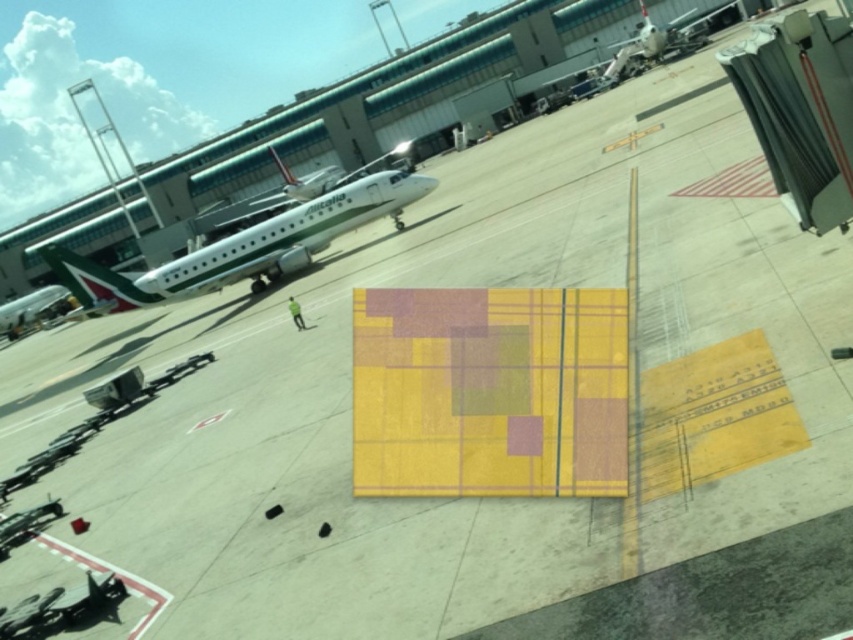
Can you confirm if white glossy airplane at upper center is shorter than metallic silver airplane at left?

Incorrect, white glossy airplane at upper center's height does not fall short of metallic silver airplane at left's.

Does white glossy airplane at upper center lie behind metallic silver airplane at left?

No.

Is point (248, 257) closer to camera compared to point (42, 305)?

Yes, point (248, 257) is closer to viewer.

You are a GUI agent. You are given a task and a screenshot of the screen. Output one action in this format:
    pyautogui.click(x=<x>, y=<y>)
    Task: Click on the white glossy airplane at upper center
    This screenshot has width=853, height=640.
    Given the screenshot: What is the action you would take?
    pyautogui.click(x=241, y=248)

Does point (189, 260) come behind point (685, 52)?

No, it is in front of (685, 52).

Does white glossy airplane at upper center have a lesser width compared to white glossy airplane at upper right?

In fact, white glossy airplane at upper center might be wider than white glossy airplane at upper right.

In order to click on white glossy airplane at upper center in this screenshot , I will do `click(241, 248)`.

At what (x,y) coordinates should I click in order to perform the action: click on white glossy airplane at upper center. Please return your answer as a coordinate pair (x, y). Looking at the image, I should click on (241, 248).

Who is lower down, white glossy airplane at upper right or metallic silver airplane at left?

Positioned lower is metallic silver airplane at left.

Is point (631, 45) behind point (44, 301)?

Yes, point (631, 45) is behind point (44, 301).

This screenshot has width=853, height=640. Identify the location of white glossy airplane at upper right. (659, 42).